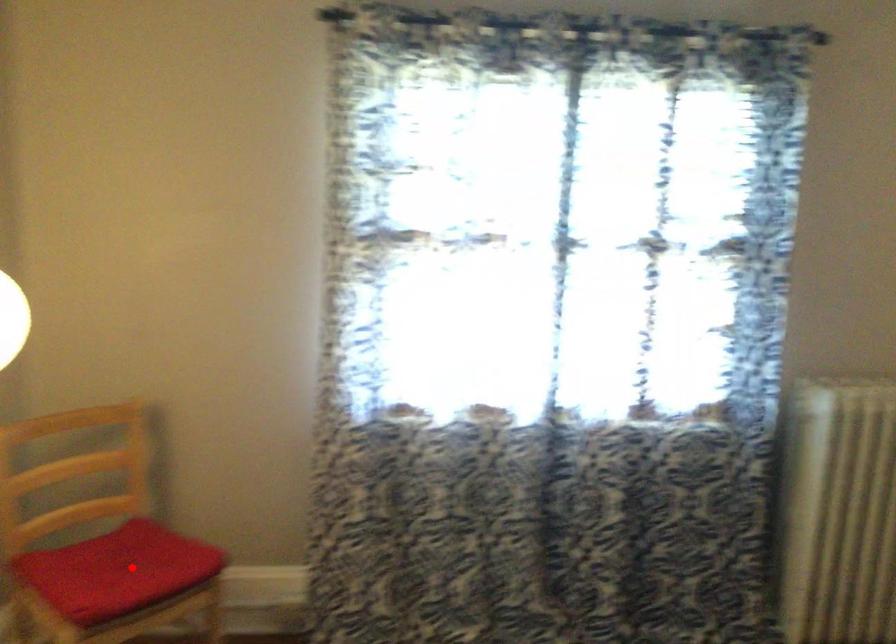
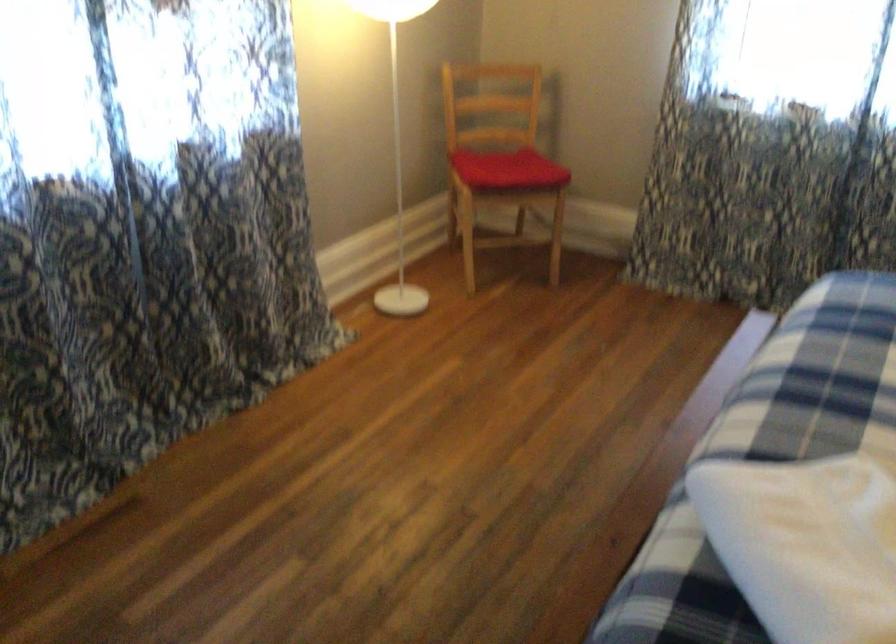
Question: I am providing you with two images of the same scene from different viewpoints. Given a red point in image1, look at the same physical point in image2. Is it:

Choices:
 (A) Closer to the viewpoint
 (B) Farther from the viewpoint

Answer: (B)